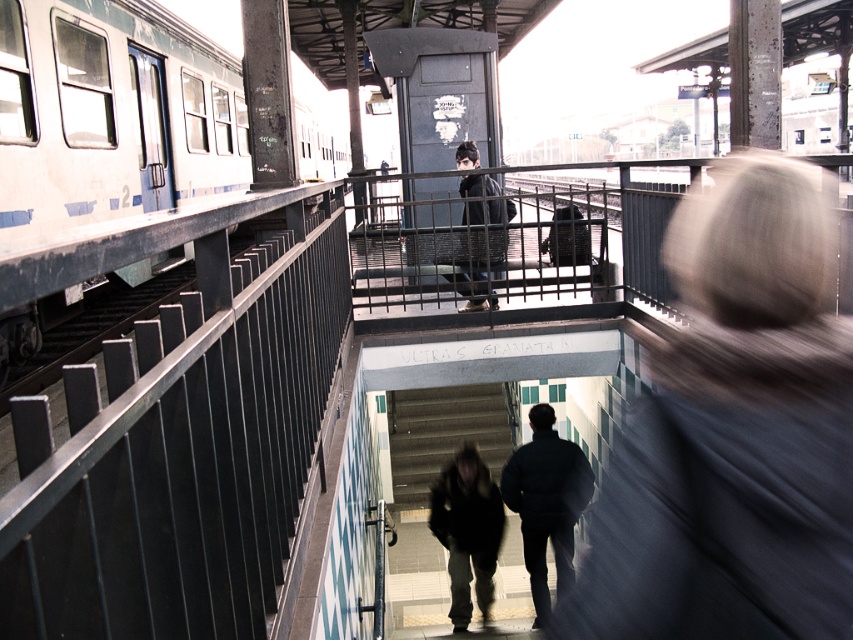
Question: Is dark blue jacket at center thinner than dark gray jacket at center?

Choices:
 (A) no
 (B) yes

Answer: (A)

Question: Among these points, which one is farthest from the camera?

Choices:
 (A) (471, 164)
 (B) (534, 593)

Answer: (A)

Question: Is blurred gray hair at upper right to the right of white painted metal train at left from the viewer's perspective?

Choices:
 (A) no
 (B) yes

Answer: (B)

Question: Among these objects, which one is nearest to the camera?

Choices:
 (A) dark gray jacket at center
 (B) dark blue jacket at center
 (C) dark brown leather jacket at center
 (D) white painted metal train at left

Answer: (D)

Question: Can you confirm if dark brown leather jacket at center is thinner than dark gray jacket at center?

Choices:
 (A) yes
 (B) no

Answer: (B)

Question: Among these objects, which one is nearest to the camera?

Choices:
 (A) white painted metal train at left
 (B) dark blue jacket at center

Answer: (A)